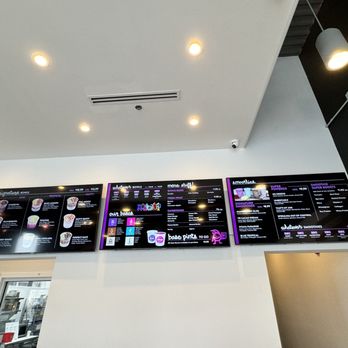
Find the location of `black board`. black board is located at coordinates (87, 229), (151, 220), (333, 222).